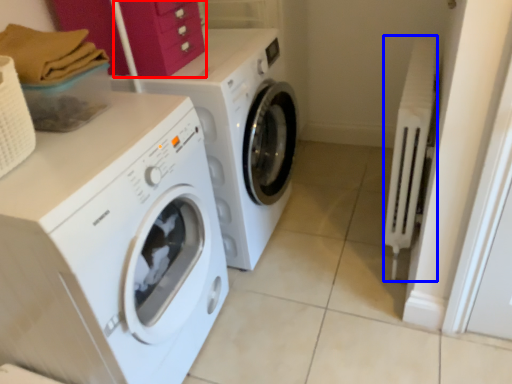
Question: Which object appears farthest to the camera in this image, drawer (highlighted by a red box) or radiator (highlighted by a blue box)?

Choices:
 (A) drawer
 (B) radiator

Answer: (B)